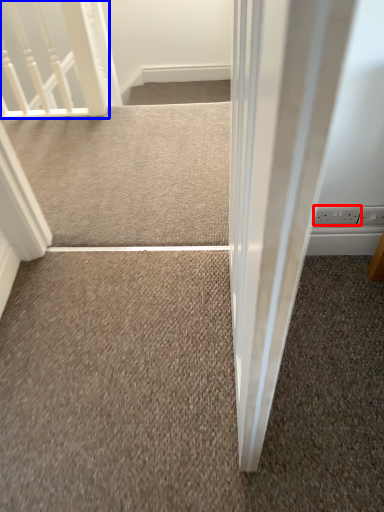
Question: Among these objects, which one is farthest to the camera, electric outlet (highlighted by a red box) or rail (highlighted by a blue box)?

Choices:
 (A) electric outlet
 (B) rail

Answer: (B)